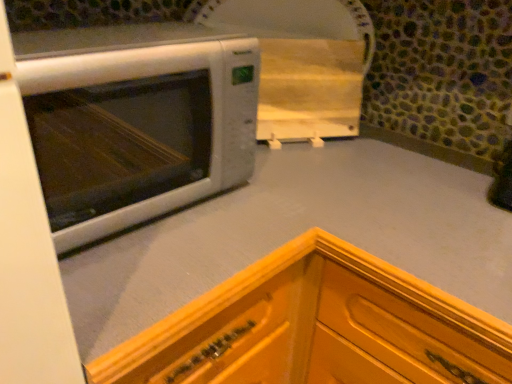
You are a GUI agent. You are given a task and a screenshot of the screen. Output one action in this format:
    pyautogui.click(x=<x>, y=<y>)
    Task: Click on the empty space that is to the right of white glossy microwave at upper left
    The height and width of the screenshot is (384, 512).
    Given the screenshot: What is the action you would take?
    pyautogui.click(x=256, y=206)